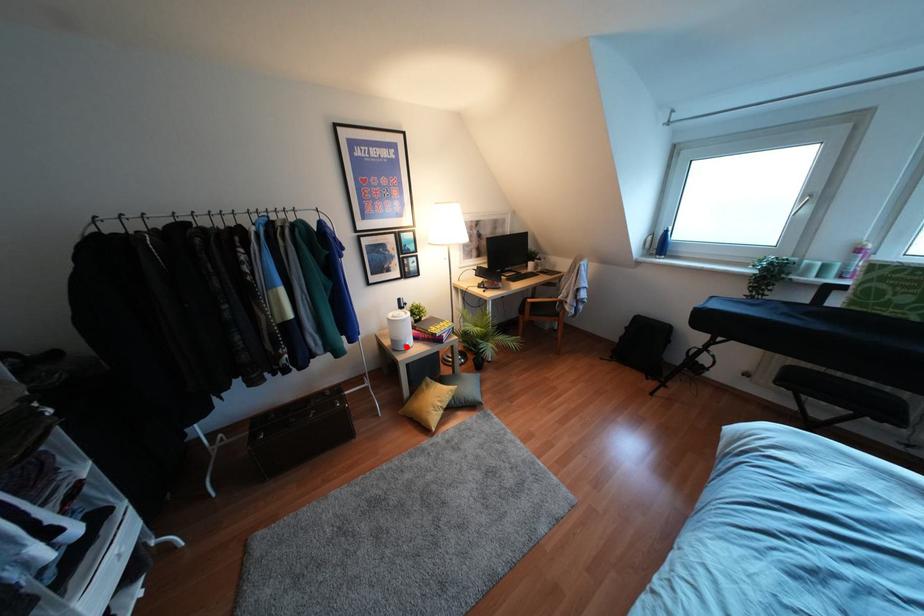
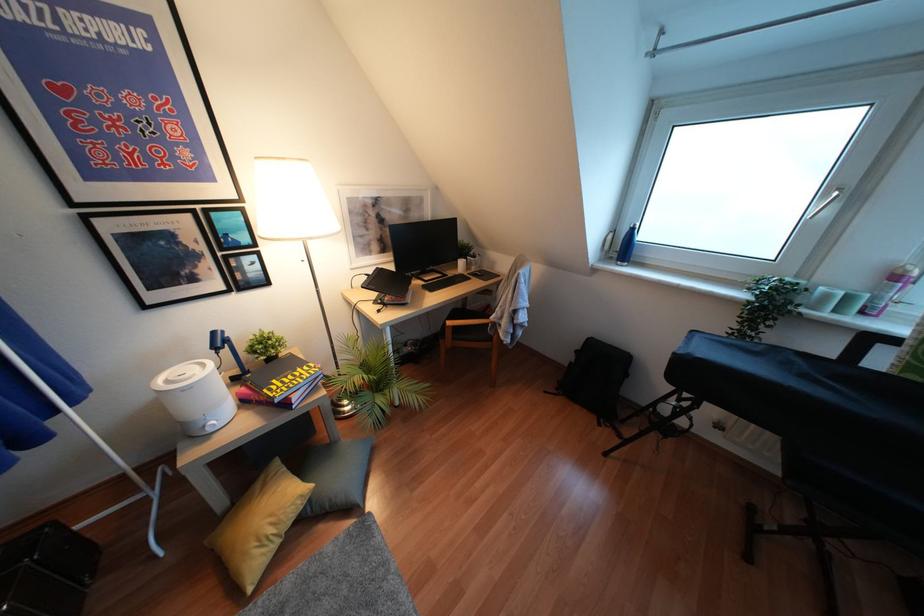
Question: I am providing you with two images of the same scene from different viewpoints. Image1 has a red point marked. In image2, the corresponding 3D location appears at what relative position? Reply with the corresponding letter.

Choices:
 (A) Closer
 (B) Farther

Answer: (A)